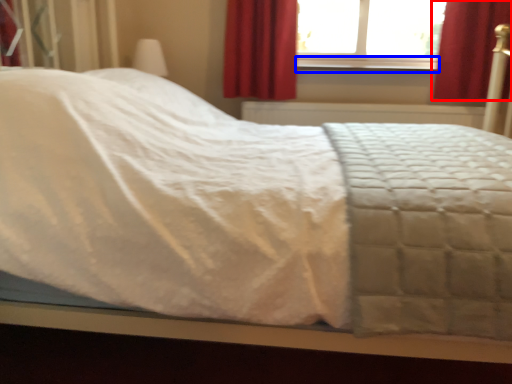
Question: Which object is closer to the camera taking this photo, curtain (highlighted by a red box) or window sill (highlighted by a blue box)?

Choices:
 (A) curtain
 (B) window sill

Answer: (A)